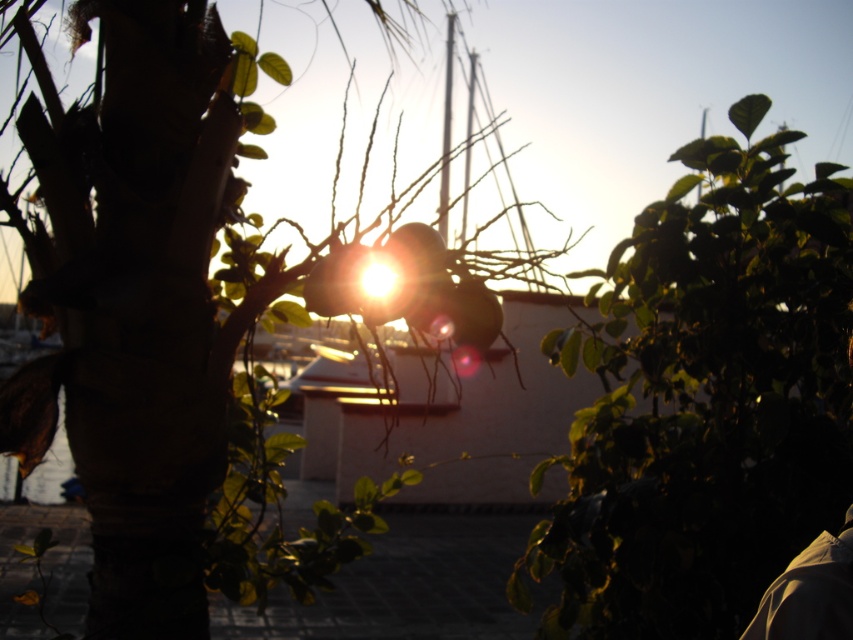
Is the position of green leafy tree at center less distant than that of green leafy plant at upper right?

Yes, it is.

Between green leafy tree at center and green leafy plant at upper right, which one has more height?

Standing taller between the two is green leafy plant at upper right.

Measure the distance between point (151, 566) and camera.

The distance of point (151, 566) from camera is 1.66 meters.

The height and width of the screenshot is (640, 853). What are the coordinates of `green leafy tree at center` in the screenshot? It's located at (141, 304).